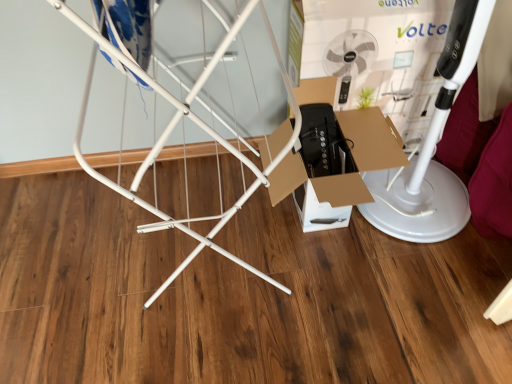
You are a GUI agent. You are given a task and a screenshot of the screen. Output one action in this format:
    pyautogui.click(x=<x>, y=<y>)
    Task: Click on the free location in front of cardboard box at center
    
    Given the screenshot: What is the action you would take?
    pyautogui.click(x=347, y=313)